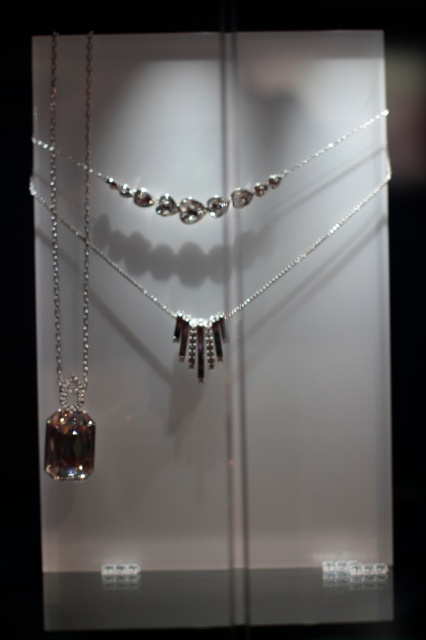
Is shiny silver necklace at center bigger than shiny silver chain at left?

Yes.

Is shiny silver necklace at center further to camera compared to shiny silver chain at left?

Yes.

Measure the distance between shiny silver necklace at center and camera.

shiny silver necklace at center is 4.67 feet away from camera.

In order to click on shiny silver necklace at center in this screenshot , I will do `click(232, 308)`.

Is shiny silver chain at left shorter than silver metallic chain at left?

Indeed, shiny silver chain at left has a lesser height compared to silver metallic chain at left.

Which is below, shiny silver chain at left or silver metallic chain at left?

shiny silver chain at left is below.

Does point (54, 198) come farther from viewer compared to point (78, 406)?

Yes, it is.

Locate an element on the screen. shiny silver chain at left is located at coordinates (x=54, y=216).

Can you confirm if shiny silver necklace at center is taller than silver metallic chain at left?

No, shiny silver necklace at center is not taller than silver metallic chain at left.

Does shiny silver necklace at center appear on the left side of silver metallic chain at left?

No, shiny silver necklace at center is not to the left of silver metallic chain at left.

Which is behind, point (204, 321) or point (89, 90)?

The point (204, 321) is more distant.

You are a GUI agent. You are given a task and a screenshot of the screen. Output one action in this format:
    pyautogui.click(x=<x>, y=<y>)
    Task: Click on the shiny silver necklace at center
    The height and width of the screenshot is (640, 426).
    Given the screenshot: What is the action you would take?
    pyautogui.click(x=232, y=308)